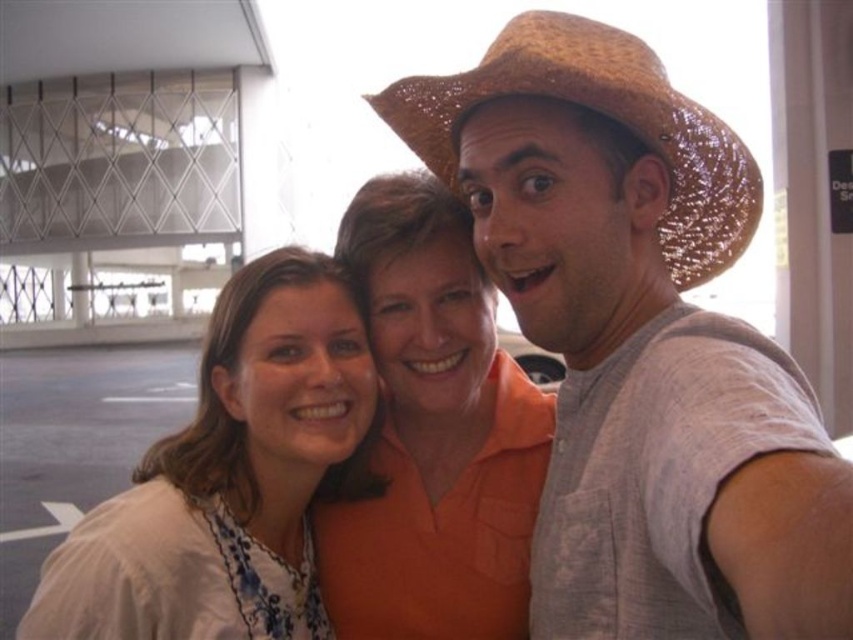
Question: Is straw hat at upper right bigger than orange cotton shirt at center?

Choices:
 (A) no
 (B) yes

Answer: (B)

Question: Can you confirm if white fabric at center is positioned above braided straw cowboy hat at upper right?

Choices:
 (A) yes
 (B) no

Answer: (B)

Question: Does white fabric at center have a lesser width compared to orange cotton shirt at center?

Choices:
 (A) no
 (B) yes

Answer: (A)

Question: Which object is farther from the camera taking this photo?

Choices:
 (A) braided straw cowboy hat at upper right
 (B) white fabric at center
 (C) orange cotton shirt at center

Answer: (C)

Question: Which object is the closest to the orange cotton shirt at center?

Choices:
 (A) white fabric at center
 (B) straw hat at upper right
 (C) braided straw cowboy hat at upper right

Answer: (A)

Question: Which of the following is the farthest from the observer?

Choices:
 (A) braided straw cowboy hat at upper right
 (B) orange cotton shirt at center

Answer: (B)